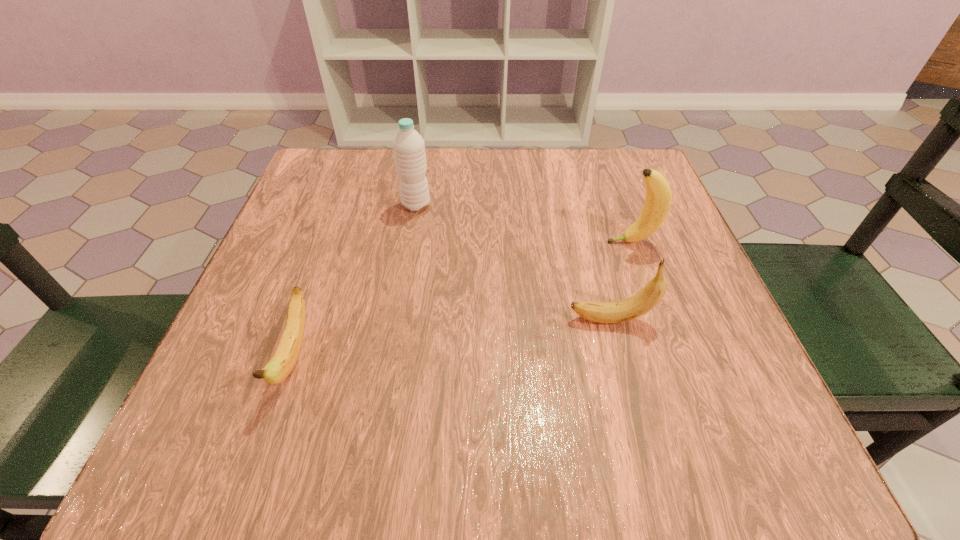
You are a GUI agent. You are given a task and a screenshot of the screen. Output one action in this format:
    pyautogui.click(x=<x>, y=<y>)
    Task: Click on the free space at the far left corner of the desktop
    This screenshot has height=540, width=960.
    Given the screenshot: What is the action you would take?
    pyautogui.click(x=340, y=149)

You are a GUI agent. You are given a task and a screenshot of the screen. Output one action in this format:
    pyautogui.click(x=<x>, y=<y>)
    Task: Click on the blank space at the far right corner of the desktop
    
    Given the screenshot: What is the action you would take?
    pyautogui.click(x=623, y=198)

Locate an element on the screen. blank space at the near right corner of the desktop is located at coordinates (702, 464).

The height and width of the screenshot is (540, 960). I want to click on free spot between the farthest banana and the second shortest object, so click(621, 281).

Locate an element on the screen. The image size is (960, 540). empty space between the farthest banana and the second shortest banana is located at coordinates (621, 281).

Locate an element on the screen. The image size is (960, 540). free space between the leftmost banana and the third nearest object is located at coordinates (463, 299).

The image size is (960, 540). I want to click on free space between the farthest object and the second tallest banana, so click(x=514, y=262).

Where is `vacant area that lies between the second shortest object and the farthest object`? vacant area that lies between the second shortest object and the farthest object is located at coordinates (514, 262).

Where is `free spot between the third tallest object and the second object from left to right`? free spot between the third tallest object and the second object from left to right is located at coordinates point(514,262).

This screenshot has height=540, width=960. I want to click on vacant point located between the third tallest object and the water bottle, so click(x=514, y=262).